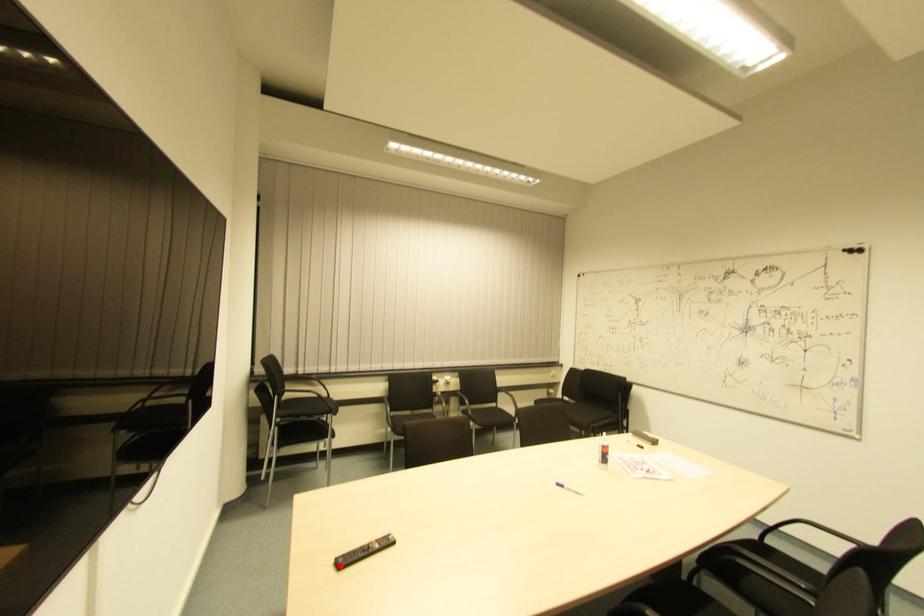
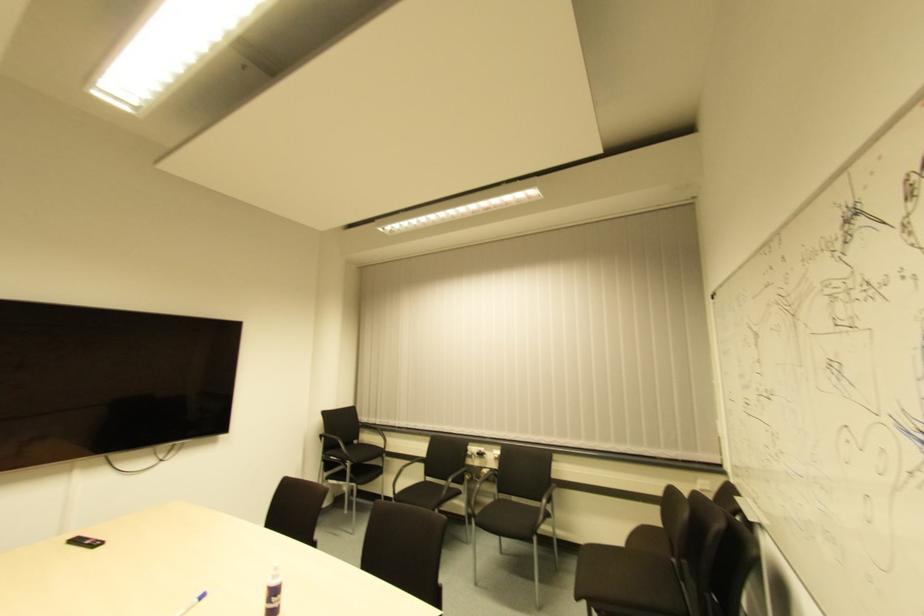
Question: A red point is marked in image1. In image2, is the corresponding 3D point closer to the camera or farther? Reply with the corresponding letter.

Choices:
 (A) The corresponding 3D point is closer.
 (B) The corresponding 3D point is farther.

Answer: (A)